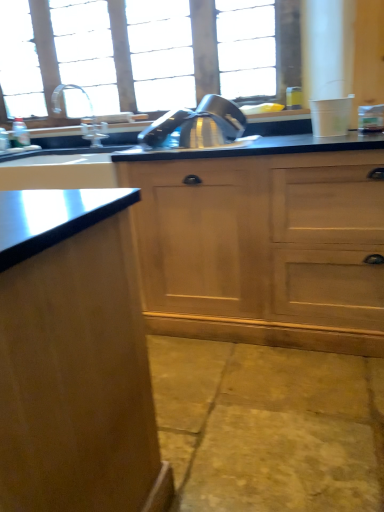
Question: Can you confirm if satin nickel faucet at upper left is bigger than yellow stone concrete at lower center?

Choices:
 (A) yes
 (B) no

Answer: (B)

Question: From the image's perspective, is satin nickel faucet at upper left located beneath yellow stone concrete at lower center?

Choices:
 (A) yes
 (B) no

Answer: (B)

Question: From the image's perspective, is satin nickel faucet at upper left over yellow stone concrete at lower center?

Choices:
 (A) yes
 (B) no

Answer: (A)

Question: Is satin nickel faucet at upper left oriented towards yellow stone concrete at lower center?

Choices:
 (A) yes
 (B) no

Answer: (B)

Question: Can you confirm if satin nickel faucet at upper left is wider than yellow stone concrete at lower center?

Choices:
 (A) no
 (B) yes

Answer: (A)

Question: Relative to clear glass window at upper center, is yellow stone concrete at lower center in front or behind?

Choices:
 (A) front
 (B) behind

Answer: (A)

Question: Is yellow stone concrete at lower center bigger or smaller than clear glass window at upper center?

Choices:
 (A) small
 (B) big

Answer: (A)

Question: From the image's perspective, is yellow stone concrete at lower center positioned above or below clear glass window at upper center?

Choices:
 (A) below
 (B) above

Answer: (A)

Question: From a real-world perspective, is yellow stone concrete at lower center physically located above or below clear glass window at upper center?

Choices:
 (A) below
 (B) above

Answer: (A)

Question: Considering the relative positions of satin nickel faucet at upper left and wooden cabinet at center in the image provided, is satin nickel faucet at upper left to the left or to the right of wooden cabinet at center?

Choices:
 (A) left
 (B) right

Answer: (A)

Question: Looking at their shapes, would you say satin nickel faucet at upper left is wider or thinner than wooden cabinet at center?

Choices:
 (A) wide
 (B) thin

Answer: (B)

Question: In the image, is satin nickel faucet at upper left positioned in front of or behind wooden cabinet at center?

Choices:
 (A) front
 (B) behind

Answer: (B)

Question: Would you say satin nickel faucet at upper left is inside or outside wooden cabinet at center?

Choices:
 (A) outside
 (B) inside

Answer: (A)

Question: In terms of width, does wooden cabinet at center look wider or thinner when compared to yellow stone concrete at lower center?

Choices:
 (A) thin
 (B) wide

Answer: (A)

Question: Is wooden cabinet at center in front of or behind yellow stone concrete at lower center in the image?

Choices:
 (A) behind
 (B) front

Answer: (A)